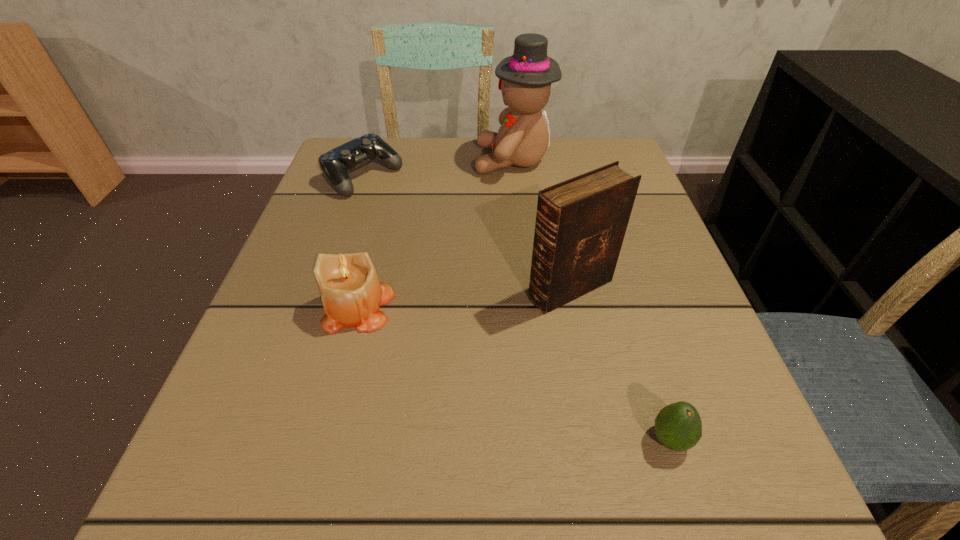
Locate an element on the screen. The width and height of the screenshot is (960, 540). free location that satisfies the following two spatial constraints: 1. on the front-facing side of the tallest object; 2. on the right side of the fourth shortest object is located at coordinates point(526,289).

At what (x,y) coordinates should I click in order to perform the action: click on vacant region that satisfies the following two spatial constraints: 1. on the front-facing side of the rag_doll; 2. on the front side of the candle. Please return your answer as a coordinate pair (x, y). Looking at the image, I should click on (528, 307).

Locate an element on the screen. vacant space that satisfies the following two spatial constraints: 1. on the front-facing side of the rag_doll; 2. on the back side of the nearest object is located at coordinates (541, 440).